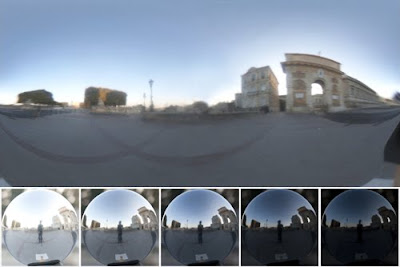
Find the location of a particular element. clock is located at coordinates click(x=321, y=70).